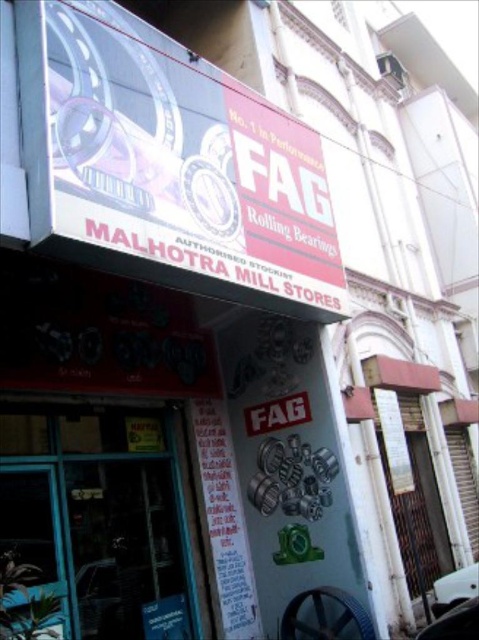
At what (x,y) coordinates should I click in order to perform the action: click on white glossy signboard at upper center. Please return your answer as a coordinate pair (x, y). Looking at the image, I should click on (183, 164).

This screenshot has width=479, height=640. What do you see at coordinates (183, 164) in the screenshot? I see `white glossy signboard at upper center` at bounding box center [183, 164].

I want to click on white glossy signboard at upper center, so click(183, 164).

Can you confirm if white glossy signboard at upper center is smaller than white paper at center?

Actually, white glossy signboard at upper center might be larger than white paper at center.

Is white glossy signboard at upper center positioned before white paper at center?

Yes, white glossy signboard at upper center is closer to the viewer.

This screenshot has width=479, height=640. What do you see at coordinates (183, 164) in the screenshot? I see `white glossy signboard at upper center` at bounding box center [183, 164].

You are a GUI agent. You are given a task and a screenshot of the screen. Output one action in this format:
    pyautogui.click(x=<x>, y=<y>)
    Task: Click on the white glossy signboard at upper center
    
    Given the screenshot: What is the action you would take?
    pyautogui.click(x=183, y=164)

Measure the distance between point (332, 278) and camera.

4.24 meters

Can you confirm if white glossy signboard at upper center is positioned above white matte car at lower right?

Correct, white glossy signboard at upper center is located above white matte car at lower right.

Who is more distant from viewer, (174, 198) or (456, 582)?

Positioned behind is point (456, 582).

At what (x,y) coordinates should I click in order to perform the action: click on white glossy signboard at upper center. Please return your answer as a coordinate pair (x, y). Looking at the image, I should click on (183, 164).